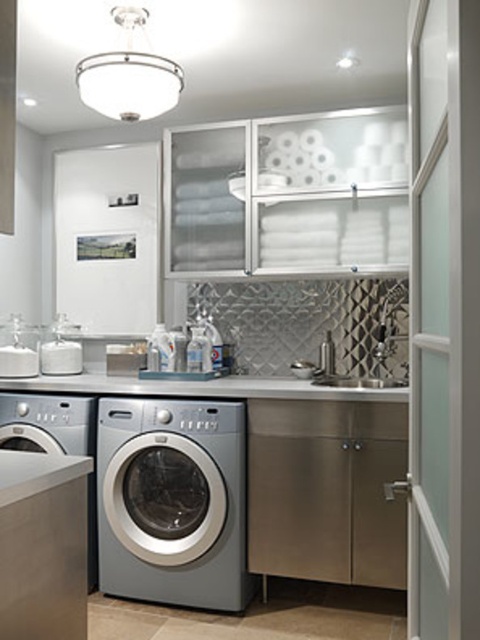
Is satin silver washer at center above white glossy countertop at center?

No.

Measure the distance between satin silver washer at center and white glossy countertop at center.

17.27 inches

Is point (101, 572) farther from camera compared to point (354, 392)?

Yes, point (101, 572) is behind point (354, 392).

This screenshot has width=480, height=640. In order to click on satin silver washer at center in this screenshot , I will do `click(172, 500)`.

Can you confirm if white glossy countertop at center is positioned above satin nickel sink at center?

No, white glossy countertop at center is not above satin nickel sink at center.

Where is `white glossy countertop at center`? Image resolution: width=480 pixels, height=640 pixels. white glossy countertop at center is located at coordinates (204, 387).

The image size is (480, 640). Identify the location of white glossy countertop at center. (204, 387).

Consider the image. Which of these two, satin silver washer at center or satin nickel sink at center, stands taller?

satin silver washer at center

Between satin silver washer at center and satin nickel sink at center, which one has less height?

satin nickel sink at center is shorter.

Is point (204, 531) closer to camera compared to point (325, 346)?

Yes, it is in front of point (325, 346).

Find the location of a particular element. This screenshot has width=480, height=640. satin silver washer at center is located at coordinates (172, 500).